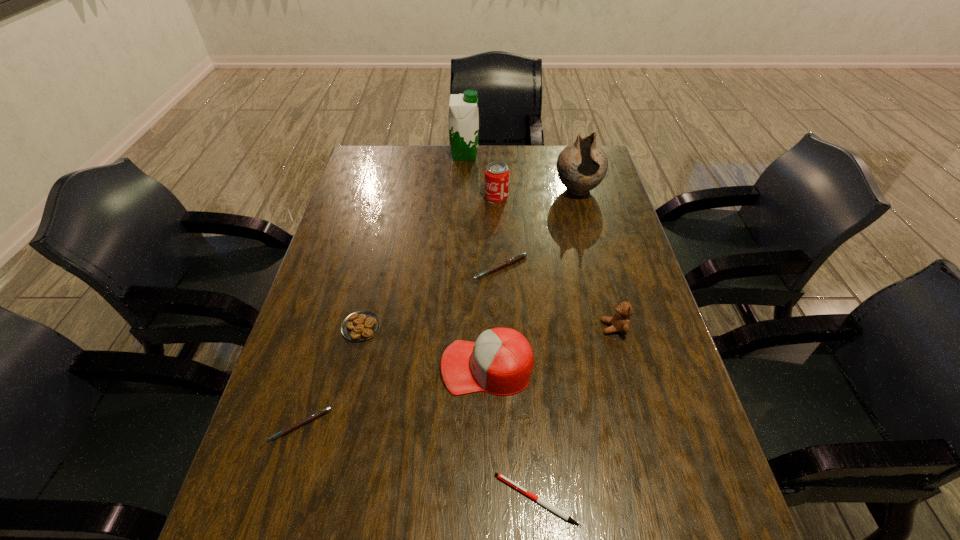
The width and height of the screenshot is (960, 540). Identify the location of vacant area located on the front-facing side of the red baseball cap. (390, 367).

Identify the location of vacant area situated on the front-facing side of the red baseball cap. (372, 367).

Where is `vacant region located 0.050m on the front-facing side of the red baseball cap`? The image size is (960, 540). vacant region located 0.050m on the front-facing side of the red baseball cap is located at coordinates (420, 367).

This screenshot has width=960, height=540. In order to click on free region located 0.110m on the right of the pastry in this screenshot , I will do `click(423, 327)`.

You are a GUI agent. You are given a task and a screenshot of the screen. Output one action in this format:
    pyautogui.click(x=<x>, y=<y>)
    Task: Click on the free space located at the nib of the tallest pen
    The width and height of the screenshot is (960, 540).
    Given the screenshot: What is the action you would take?
    pyautogui.click(x=503, y=311)

This screenshot has width=960, height=540. In order to click on free region located 0.090m at the nib of the leftmost pen in this screenshot , I will do `click(281, 489)`.

At what (x,y) coordinates should I click in order to perform the action: click on free space located on the clicker of the nearest object. Please return your answer as a coordinate pair (x, y). Image resolution: width=960 pixels, height=540 pixels. Looking at the image, I should click on (341, 500).

Locate an element on the screen. The image size is (960, 540). vacant space situated on the clicker of the nearest object is located at coordinates (399, 500).

The width and height of the screenshot is (960, 540). I want to click on vacant area situated on the clicker of the nearest object, so 357,500.

The width and height of the screenshot is (960, 540). What are the coordinates of `soya milk that is at the far edge` in the screenshot? It's located at (463, 117).